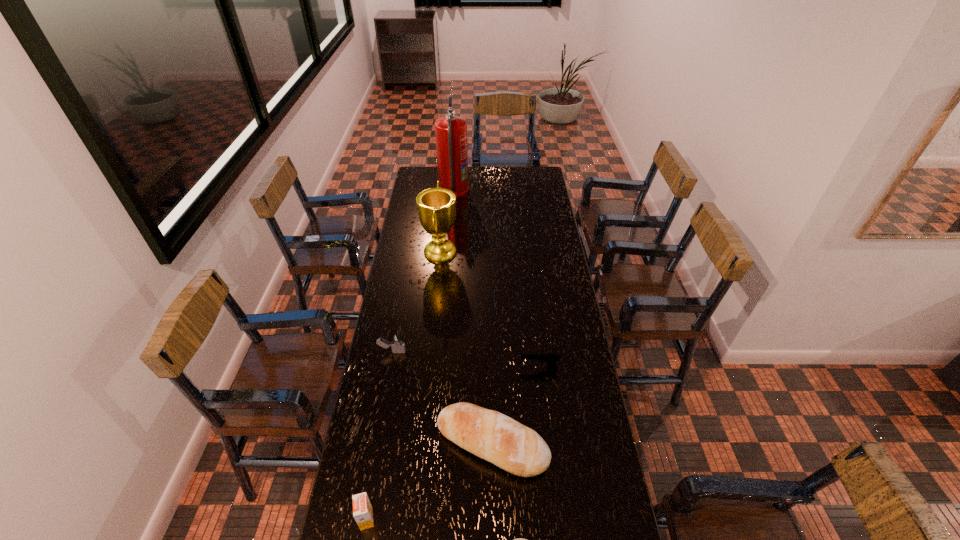
Locate an element on the screen. Image resolution: width=960 pixels, height=540 pixels. fire extinguisher is located at coordinates (450, 131).

Locate an element on the screen. This screenshot has width=960, height=540. the farthest object is located at coordinates (450, 131).

The height and width of the screenshot is (540, 960). Find the location of `the sixth shortest object`. the sixth shortest object is located at coordinates tap(436, 206).

Locate an element on the screen. The image size is (960, 540). award is located at coordinates (436, 206).

Where is `bread`? The width and height of the screenshot is (960, 540). bread is located at coordinates (490, 435).

Locate an element on the screen. orange juice is located at coordinates (362, 509).

Locate an element on the screen. igniter is located at coordinates (397, 344).

I want to click on the second shortest object, so click(x=550, y=358).

Where is `the fourth farthest object`? This screenshot has height=540, width=960. the fourth farthest object is located at coordinates (550, 358).

You are a GUI agent. You are given a task and a screenshot of the screen. Output one action in this format:
    pyautogui.click(x=<x>, y=<y>)
    Task: Click on the free space located on the instruction side of the tallest object
    
    Given the screenshot: What is the action you would take?
    pyautogui.click(x=486, y=191)